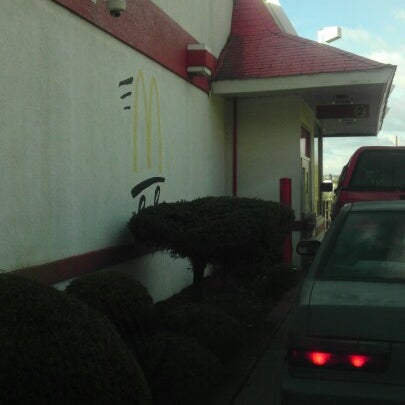
Find the location of a particular element. Image resolution: width=405 pixels, height=405 pixels. concrete wall is located at coordinates (85, 226).